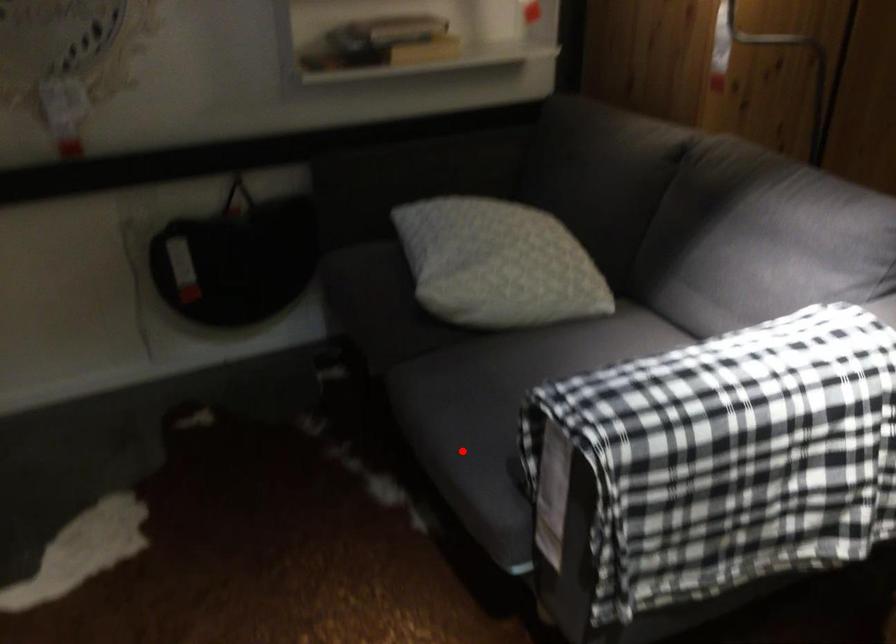
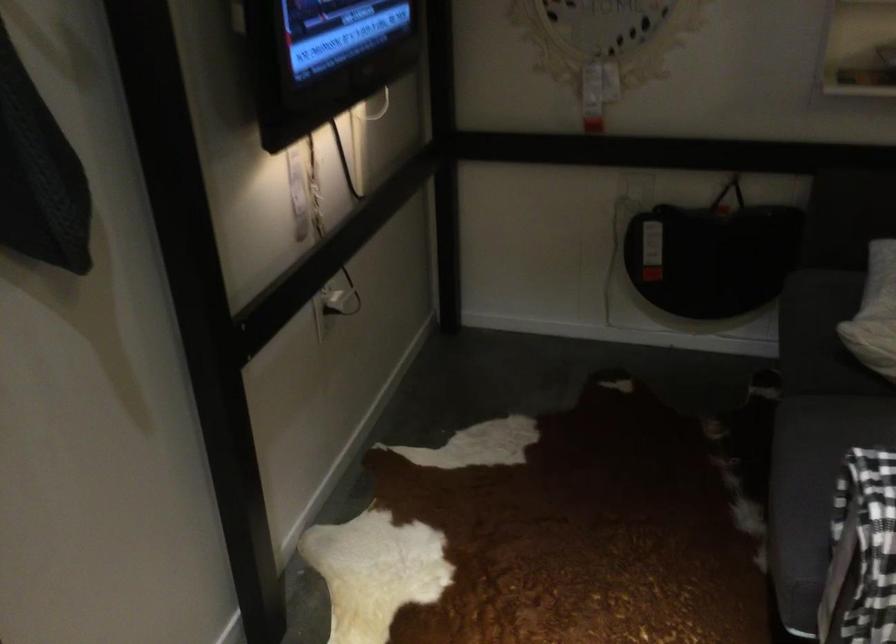
Question: I am providing you with two images of the same scene from different viewpoints. Image1 has a red point marked. In image2, the corresponding 3D location appears at what relative position? Reply with the corresponding letter.

Choices:
 (A) Closer
 (B) Farther

Answer: (A)